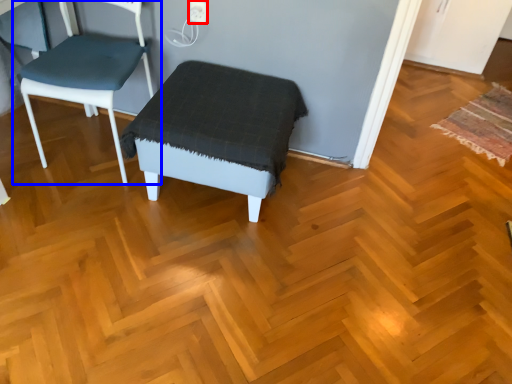
Question: Which object is further to the camera taking this photo, electric outlet (highlighted by a red box) or chair (highlighted by a blue box)?

Choices:
 (A) electric outlet
 (B) chair

Answer: (A)